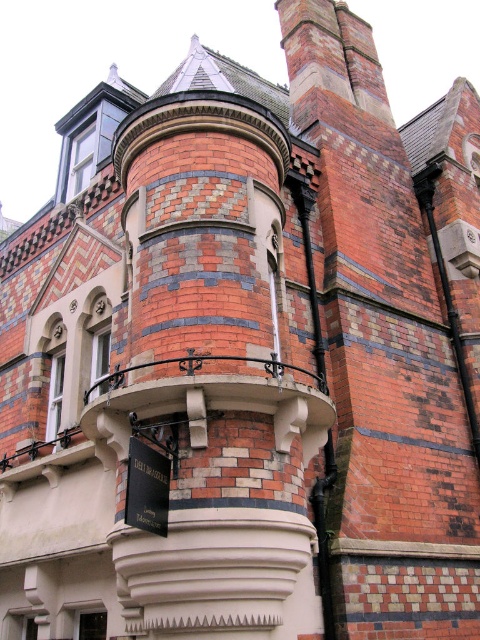
Which is behind, point (165, 456) or point (471, 236)?

The point (471, 236) is behind.

Between black matte sign at lower center and white plastic clock at upper center, which one has less height?

With less height is white plastic clock at upper center.

Which is in front, point (130, 504) or point (472, 228)?

Positioned in front is point (130, 504).

You are a GUI agent. You are given a task and a screenshot of the screen. Output one action in this format:
    pyautogui.click(x=<x>, y=<y>)
    Task: Click on the black matte sign at lower center
    
    Given the screenshot: What is the action you would take?
    pyautogui.click(x=146, y=488)